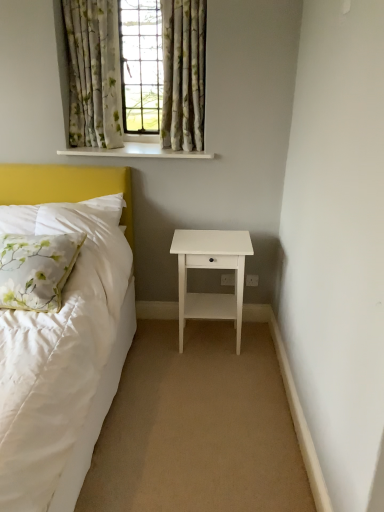
This screenshot has width=384, height=512. Identify the location of vacant space situated on the left part of white glossy nightstand at lower right. (154, 347).